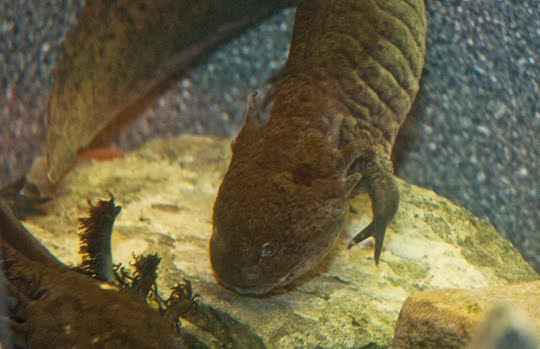
Identify the location of plant. Image resolution: width=540 pixels, height=349 pixels. (40, 291).